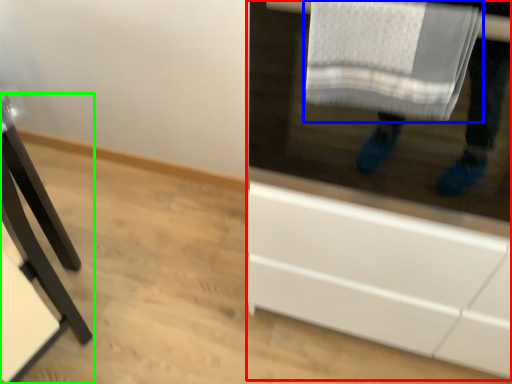
Question: Which object is the closest to the cabinetry (highlighted by a red box)? Choose among these: bath towel (highlighted by a blue box) or furniture (highlighted by a green box).

Choices:
 (A) bath towel
 (B) furniture

Answer: (A)